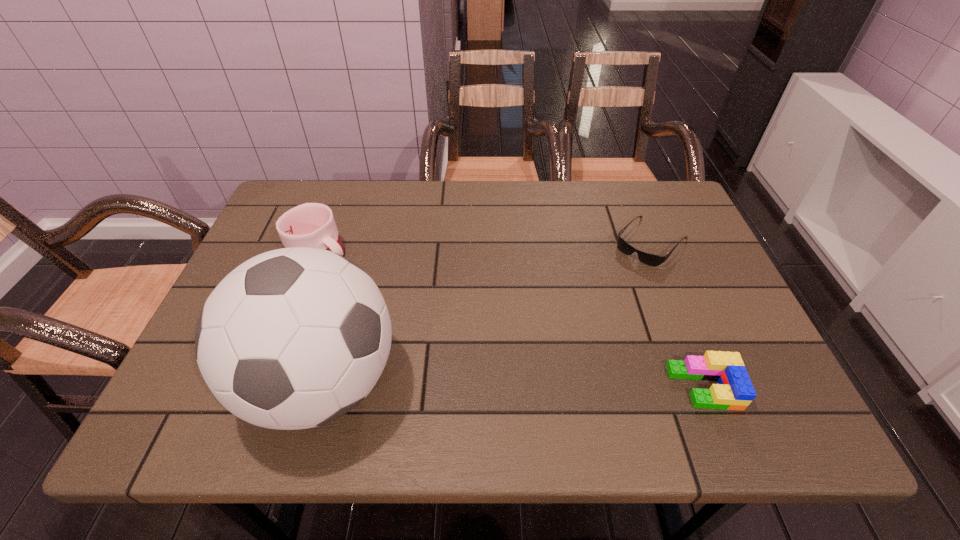
Where is `object present at the far right corner`? This screenshot has height=540, width=960. object present at the far right corner is located at coordinates (649, 259).

Find the location of `object that is positioned at the near right corner`. object that is positioned at the near right corner is located at coordinates (734, 391).

In the image, there is a desktop. At what (x,y) coordinates should I click in order to perform the action: click on vacant space at the far edge. Please return your answer as a coordinate pair (x, y). The height and width of the screenshot is (540, 960). Looking at the image, I should click on (499, 218).

Locate an element on the screen. This screenshot has height=540, width=960. free spot at the near edge of the desktop is located at coordinates (528, 372).

The width and height of the screenshot is (960, 540). Identify the location of vacant space at the right edge of the desktop. (x=663, y=246).

I want to click on vacant point at the far right corner, so click(671, 182).

The image size is (960, 540). I want to click on vacant area that lies between the sunglasses and the tallest object, so click(x=487, y=312).

Find the location of a particular element. free space between the soccer ball and the sunglasses is located at coordinates (487, 312).

I want to click on vacant area that lies between the tallest object and the Lego, so click(x=514, y=385).

You are a GUI agent. You are given a task and a screenshot of the screen. Output one action in this format:
    pyautogui.click(x=<x>, y=<y>)
    Task: Click on the blank region between the Lego and the soccer ball
    
    Given the screenshot: What is the action you would take?
    pyautogui.click(x=514, y=385)